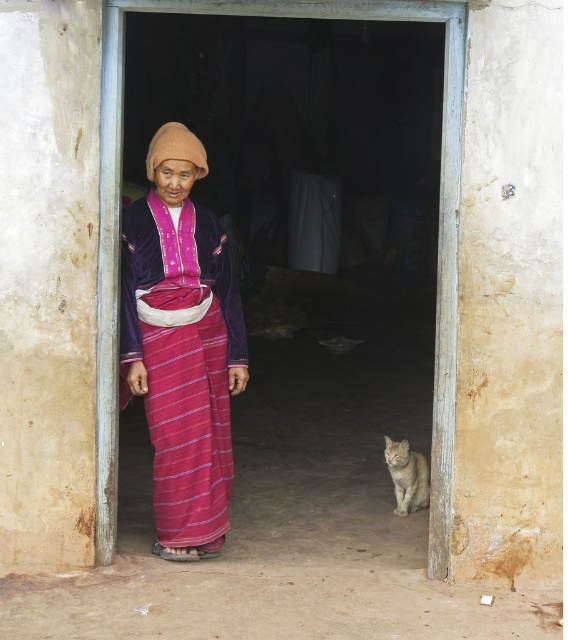
Does wooden door at center have a lesser height compared to golden fur cat at lower right?

In fact, wooden door at center may be taller than golden fur cat at lower right.

Is wooden door at center positioned before golden fur cat at lower right?

Yes, wooden door at center is closer to the viewer.

Image resolution: width=568 pixels, height=640 pixels. What are the coordinates of `wooden door at center` in the screenshot? It's located at (437, 240).

The height and width of the screenshot is (640, 568). In order to click on wooden door at center in this screenshot , I will do `click(437, 240)`.

Where is `velvet purple blouse at center`? This screenshot has width=568, height=640. velvet purple blouse at center is located at coordinates (181, 346).

Does velvet purple blouse at center come in front of wooden door at center?

No, it is behind wooden door at center.

Is point (194, 275) behind point (108, 10)?

Yes, point (194, 275) is farther from viewer.

Find the location of a particular element. This screenshot has height=640, width=568. velvet purple blouse at center is located at coordinates (181, 346).

Can you confirm if velvet purple blouse at center is positioned to the right of golden fur cat at lower right?

In fact, velvet purple blouse at center is to the left of golden fur cat at lower right.

Who is taller, velvet purple blouse at center or golden fur cat at lower right?

Standing taller between the two is velvet purple blouse at center.

Is point (198, 349) closer to camera compared to point (402, 472)?

Yes.

Locate an element on the screen. The height and width of the screenshot is (640, 568). velvet purple blouse at center is located at coordinates (181, 346).